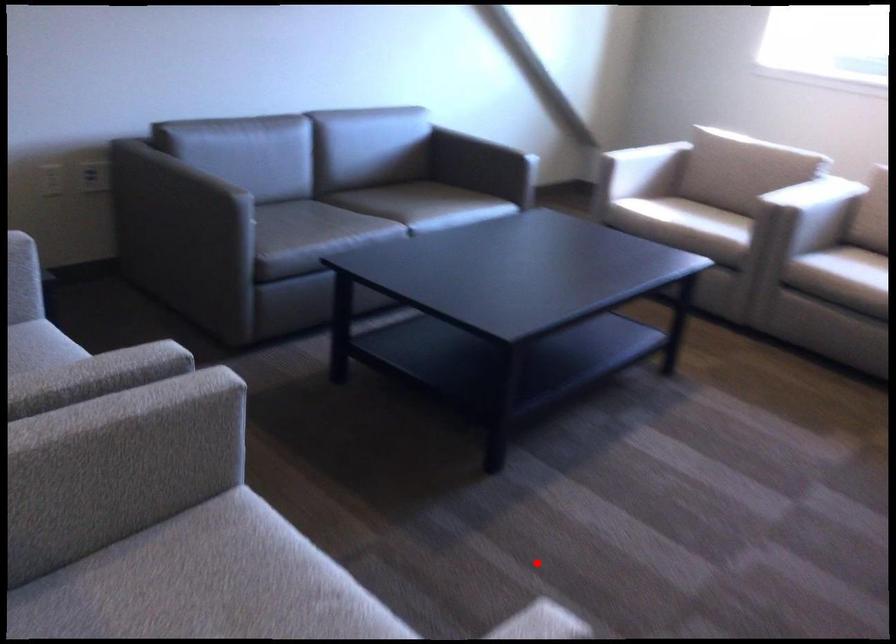
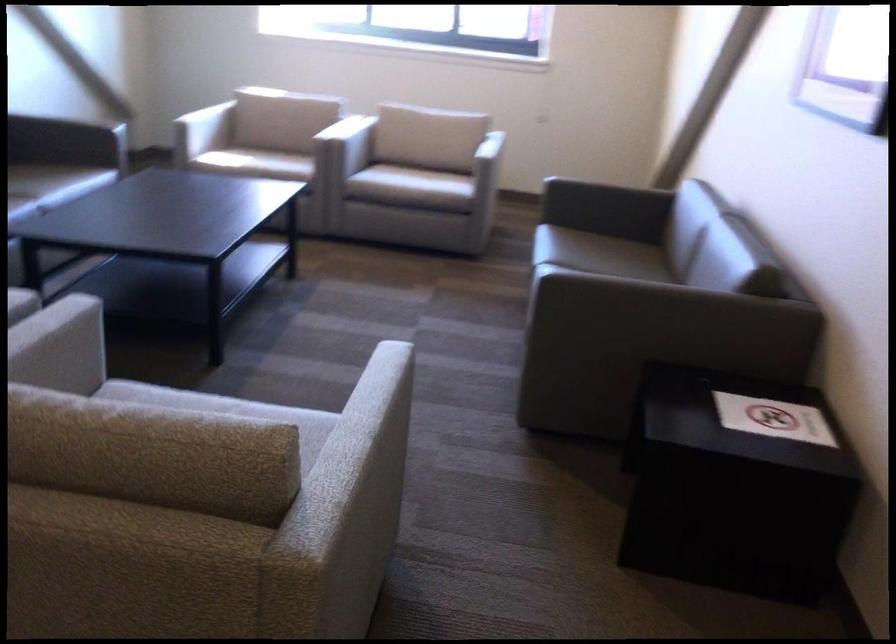
Question: I am providing you with two images of the same scene from different viewpoints. Given a red point in image1, look at the same physical point in image2. Is it:

Choices:
 (A) Closer to the viewpoint
 (B) Farther from the viewpoint

Answer: (B)